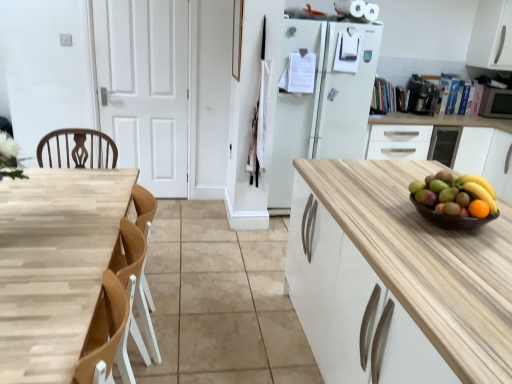
Question: Can you confirm if white matte cabinet at upper right, the second cabinetry from the bottom, is taller than white matte door at center?

Choices:
 (A) yes
 (B) no

Answer: (B)

Question: Considering the relative positions of white matte cabinet at upper right, acting as the first cabinetry starting from the top, and white matte door at center in the image provided, is white matte cabinet at upper right, acting as the first cabinetry starting from the top, to the left of white matte door at center from the viewer's perspective?

Choices:
 (A) yes
 (B) no

Answer: (B)

Question: Is white matte cabinet at upper right, the second cabinetry from the bottom, touching white matte door at center?

Choices:
 (A) no
 (B) yes

Answer: (A)

Question: Could white matte door at center be considered to be inside white matte cabinet at upper right, the second cabinetry from the bottom?

Choices:
 (A) yes
 (B) no

Answer: (B)

Question: Could you tell me if white matte cabinet at upper right, the second cabinetry from the bottom, is facing white matte door at center?

Choices:
 (A) yes
 (B) no

Answer: (B)

Question: Choose the correct answer: Is white matte cabinet at upper right, the second cabinetry from the bottom, inside metallic silver microwave at right, placed as the 1th appliance when sorted from right to left, or outside it?

Choices:
 (A) inside
 (B) outside

Answer: (B)

Question: Is white matte cabinet at upper right, acting as the first cabinetry starting from the top, in front of or behind metallic silver microwave at right, placed as the 1th appliance when sorted from right to left, in the image?

Choices:
 (A) behind
 (B) front

Answer: (B)

Question: Is white matte cabinet at upper right, acting as the first cabinetry starting from the top, wider or thinner than metallic silver microwave at right, placed as the 1th appliance when sorted from right to left?

Choices:
 (A) thin
 (B) wide

Answer: (B)

Question: Based on their positions, is white matte cabinet at upper right, acting as the first cabinetry starting from the top, located to the left or right of metallic silver microwave at right, placed as the 1th appliance when sorted from right to left?

Choices:
 (A) left
 (B) right

Answer: (A)

Question: Considering their positions, is matte brown bowl at right located in front of or behind orange matte grapefruit at right?

Choices:
 (A) behind
 (B) front

Answer: (A)

Question: From the image's perspective, is matte brown bowl at right positioned above or below orange matte grapefruit at right?

Choices:
 (A) below
 (B) above

Answer: (A)

Question: Looking at their shapes, would you say matte brown bowl at right is wider or thinner than orange matte grapefruit at right?

Choices:
 (A) wide
 (B) thin

Answer: (A)

Question: From their relative heights in the image, would you say matte brown bowl at right is taller or shorter than orange matte grapefruit at right?

Choices:
 (A) tall
 (B) short

Answer: (B)

Question: Does point (404, 127) appear closer or farther from the camera than point (417, 104)?

Choices:
 (A) closer
 (B) farther

Answer: (A)

Question: Visually, is white matte cabinet at right, acting as the first cabinetry starting from the bottom, positioned to the left or to the right of black plastic coffee maker at upper right, the first appliance in the left-to-right sequence?

Choices:
 (A) left
 (B) right

Answer: (B)